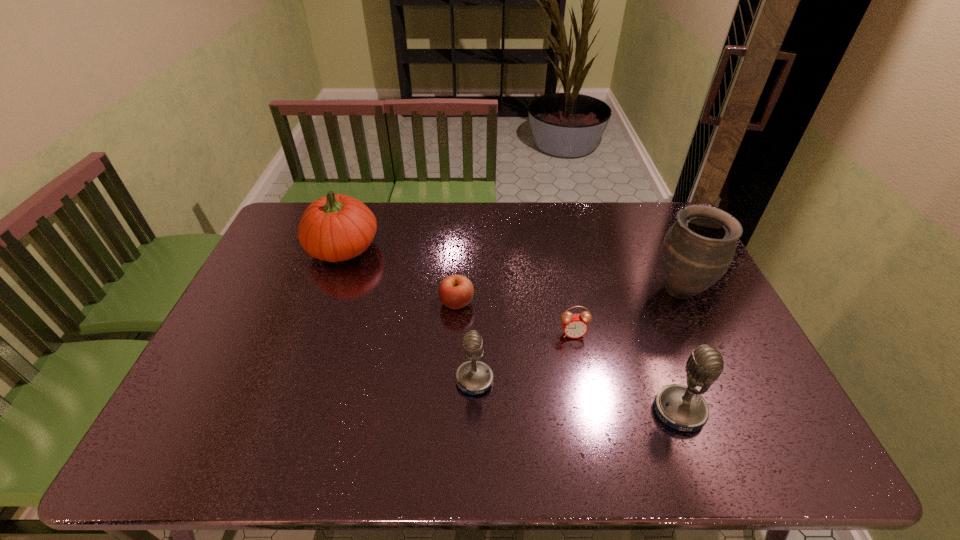
You are a GUI agent. You are given a task and a screenshot of the screen. Output one action in this format:
    pyautogui.click(x=<x>, y=<y>)
    Task: Click on the free space located 0.160m on the front-facing side of the shorter microphone
    The image size is (960, 540).
    Given the screenshot: What is the action you would take?
    pyautogui.click(x=393, y=380)

Where is `vacant space situated on the front-facing side of the taller microphone`? The height and width of the screenshot is (540, 960). vacant space situated on the front-facing side of the taller microphone is located at coordinates (750, 411).

In order to click on free location located on the right of the apple in this screenshot , I will do `click(538, 303)`.

Identify the location of free space located on the left of the urn. (526, 290).

At what (x,y) coordinates should I click in order to perform the action: click on vacant position located 0.300m on the right of the pumpkin. Please return your answer as a coordinate pair (x, y). The height and width of the screenshot is (540, 960). Looking at the image, I should click on (x=468, y=248).

Locate an element on the screen. Image resolution: width=960 pixels, height=540 pixels. free location located 0.120m on the clock face of the third nearest object is located at coordinates (582, 376).

I want to click on object present at the far edge, so click(334, 228).

Locate an element on the screen. object that is at the left edge is located at coordinates (334, 228).

Image resolution: width=960 pixels, height=540 pixels. In order to click on object present at the right edge in this screenshot , I will do `click(698, 249)`.

The image size is (960, 540). What are the coordinates of `object that is at the far left corner` in the screenshot? It's located at (334, 228).